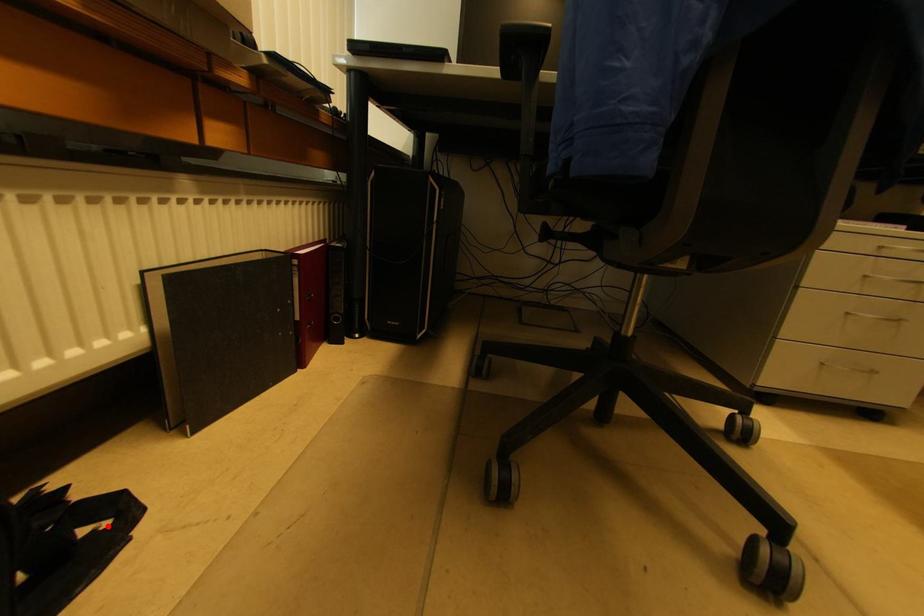
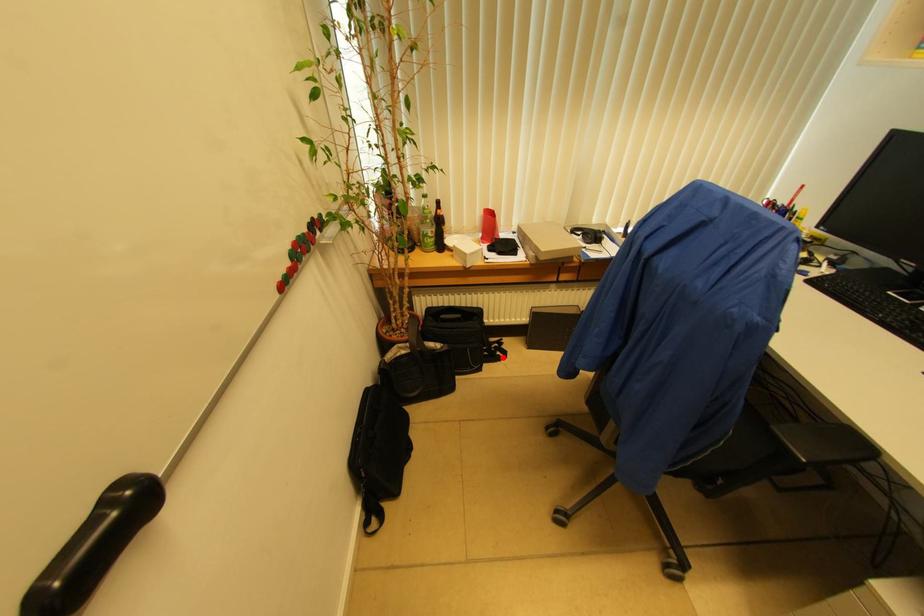
I am providing you with two images of the same scene from different viewpoints. A red point is marked on the first image and another point is marked on the second image. Are the points marked in image1 and image2 representing the same 3D position?

Yes